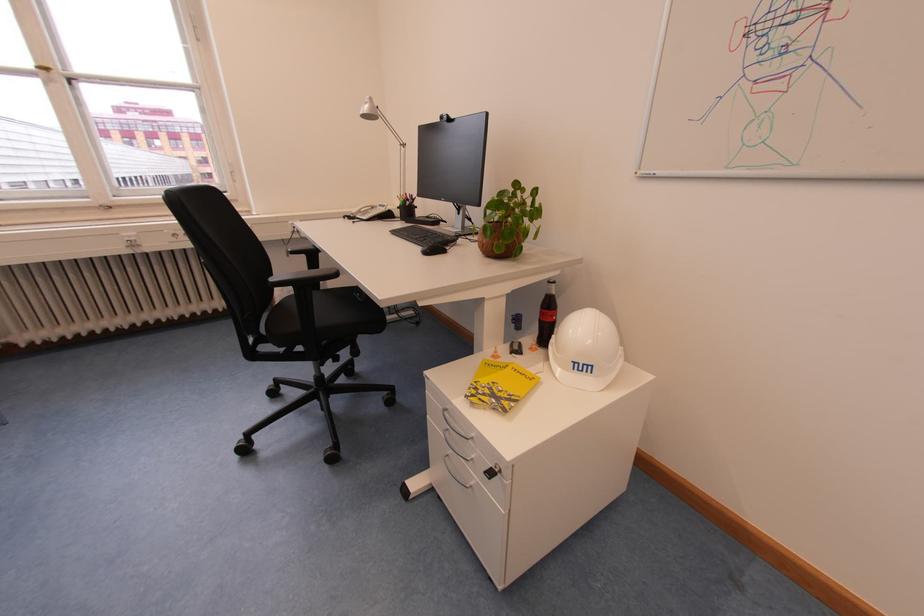
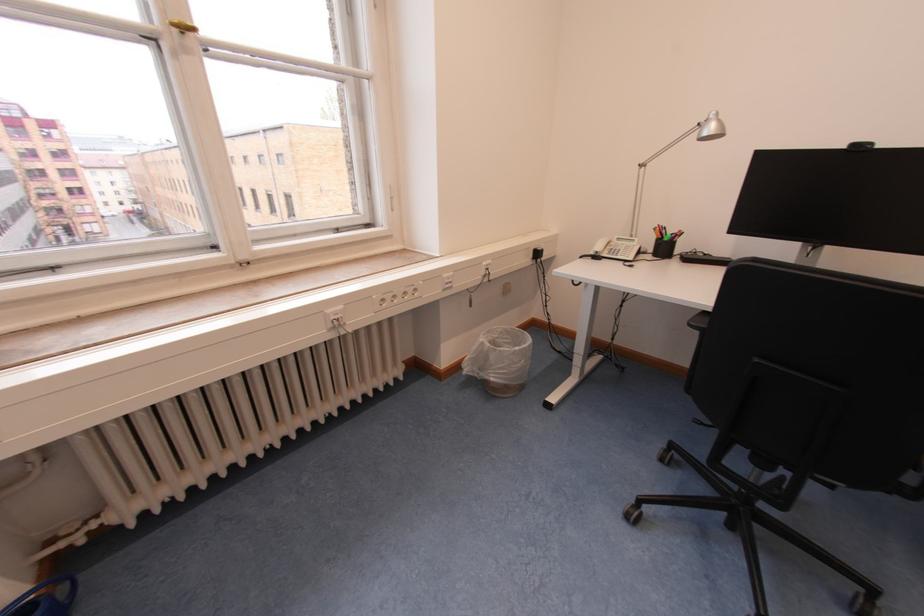
Locate, in the second image, the point that corresponds to pixel 387 208 in the first image.

(625, 241)